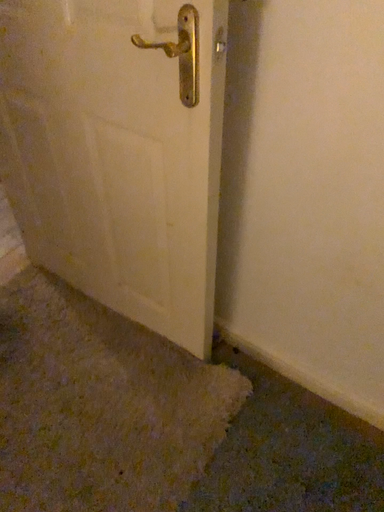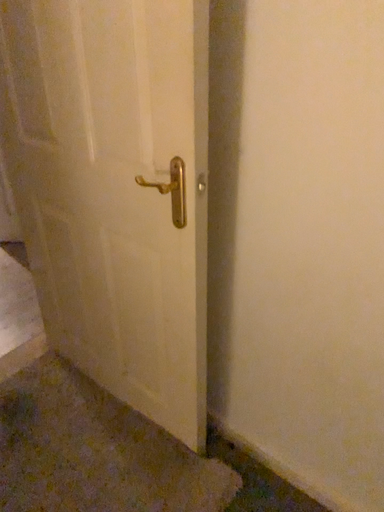
Question: Which way did the camera rotate in the video?

Choices:
 (A) rotated upward
 (B) rotated downward

Answer: (A)